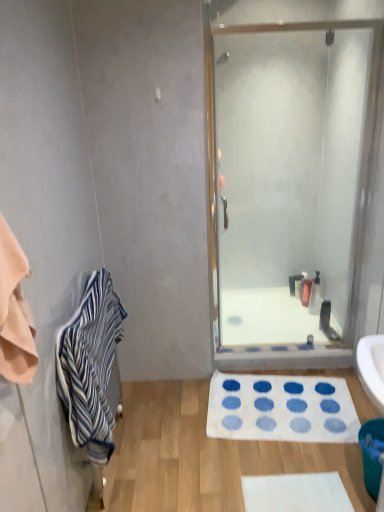
Question: Is clear glass shower door at center turned away from white glossy bath at center?

Choices:
 (A) no
 (B) yes

Answer: (B)

Question: Is clear glass shower door at center outside white glossy bath at center?

Choices:
 (A) yes
 (B) no

Answer: (A)

Question: Is clear glass shower door at center next to white glossy bath at center and touching it?

Choices:
 (A) no
 (B) yes

Answer: (A)

Question: Is clear glass shower door at center shorter than white glossy bath at center?

Choices:
 (A) yes
 (B) no

Answer: (B)

Question: Is clear glass shower door at center behind white glossy bath at center?

Choices:
 (A) yes
 (B) no

Answer: (B)

Question: Is blue striped towel at left situated inside translucent plastic soap dispenser at center or outside?

Choices:
 (A) inside
 (B) outside

Answer: (B)

Question: In the image, is blue striped towel at left positioned in front of or behind translucent plastic soap dispenser at center?

Choices:
 (A) front
 (B) behind

Answer: (A)

Question: Is point (66, 371) positioned closer to the camera than point (309, 286)?

Choices:
 (A) closer
 (B) farther

Answer: (A)

Question: Would you say blue striped towel at left is to the left or to the right of translucent plastic soap dispenser at center in the picture?

Choices:
 (A) left
 (B) right

Answer: (A)

Question: Based on their sizes in the image, would you say teal plastic trash can at lower right is bigger or smaller than blue striped towel at left?

Choices:
 (A) big
 (B) small

Answer: (B)

Question: Is teal plastic trash can at lower right wider or thinner than blue striped towel at left?

Choices:
 (A) thin
 (B) wide

Answer: (A)

Question: Is teal plastic trash can at lower right to the left or to the right of blue striped towel at left in the image?

Choices:
 (A) right
 (B) left

Answer: (A)

Question: From a real-world perspective, is teal plastic trash can at lower right physically located above or below blue striped towel at left?

Choices:
 (A) below
 (B) above

Answer: (A)

Question: In terms of height, does translucent plastic soap dispenser at center look taller or shorter compared to blue striped towel at left?

Choices:
 (A) short
 (B) tall

Answer: (A)

Question: Would you say translucent plastic soap dispenser at center is to the left or to the right of blue striped towel at left in the picture?

Choices:
 (A) left
 (B) right

Answer: (B)